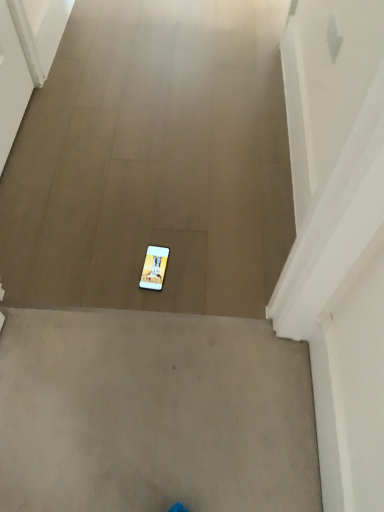
You are a GUI agent. You are given a task and a screenshot of the screen. Output one action in this format:
    pyautogui.click(x=<x>, y=<y>)
    Task: Click on the free point in front of white glossy mobile phone at center
    This screenshot has width=384, height=512.
    Given the screenshot: What is the action you would take?
    pyautogui.click(x=151, y=306)